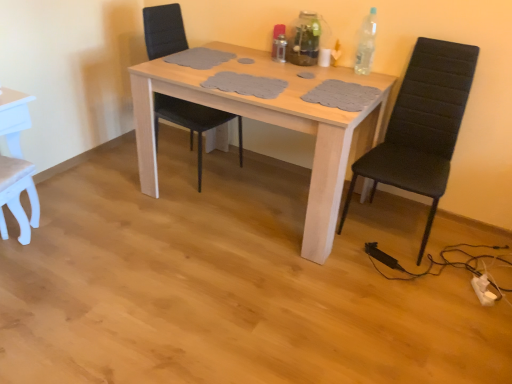
Identify the location of free point in front of transparent glass vase at upper center, arranged as the 2th bottle when viewed from the right. Image resolution: width=512 pixels, height=384 pixels. [313, 71].